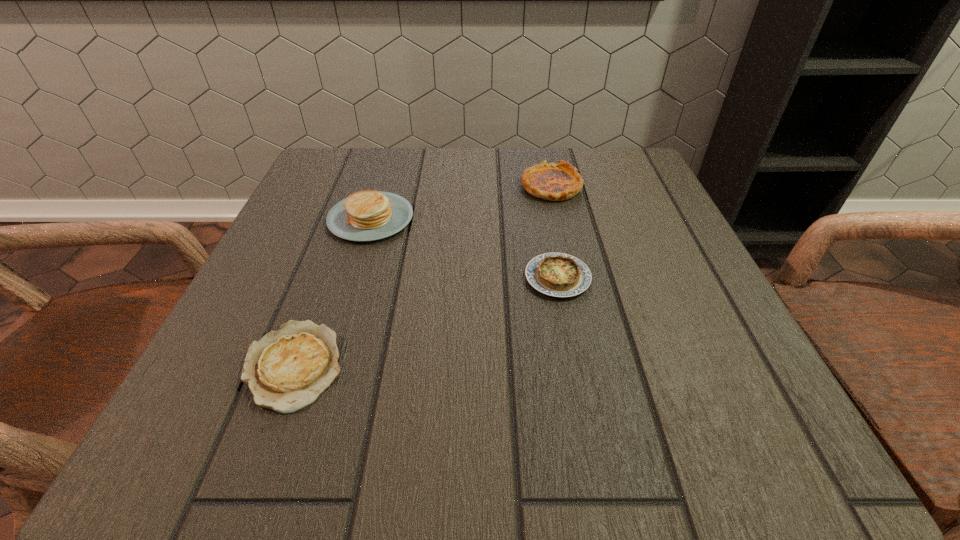
The width and height of the screenshot is (960, 540). I want to click on vacant space at the near edge, so click(520, 431).

In the image, there is a desktop. In order to click on vacant space at the left edge in this screenshot , I will do `click(190, 395)`.

Where is `vacant space at the right edge`? The width and height of the screenshot is (960, 540). vacant space at the right edge is located at coordinates (701, 351).

Where is `free space at the far left corner`? free space at the far left corner is located at coordinates (343, 168).

Find the location of `vacant region at the far right corner of the desktop`. vacant region at the far right corner of the desktop is located at coordinates (644, 176).

At what (x,y) coordinates should I click in order to perform the action: click on free spot at the near right corner of the desktop. Please return your answer as a coordinate pair (x, y). Image resolution: width=960 pixels, height=540 pixels. Looking at the image, I should click on (722, 448).

At what (x,y) coordinates should I click in order to perform the action: click on unoccupied area between the third farthest object and the third shortest object. Please return your answer as a coordinate pair (x, y). Looking at the image, I should click on (555, 232).

This screenshot has width=960, height=540. I want to click on vacant space in between the shortest quiche and the pancake, so click(x=332, y=292).

Image resolution: width=960 pixels, height=540 pixels. I want to click on empty space that is in between the third farthest object and the tallest object, so click(465, 248).

Locate an element on the screen. This screenshot has height=540, width=960. empty space between the pancake and the nearest object is located at coordinates (332, 292).